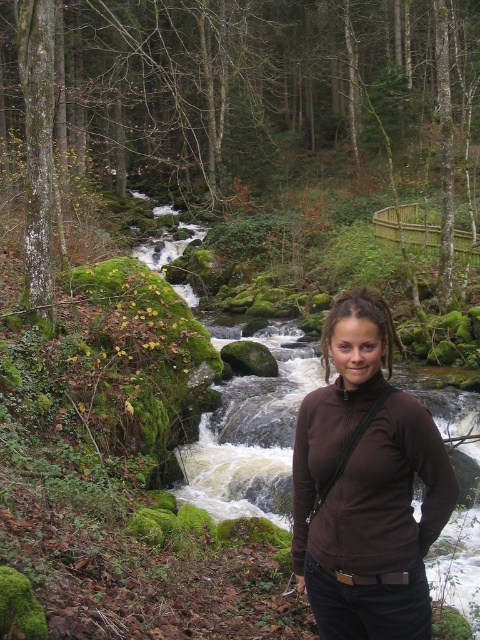
Can you confirm if brown matte jacket at center is positioned to the right of white frothy water at center?

Yes, brown matte jacket at center is to the right of white frothy water at center.

Identify the location of brown matte jacket at center. Image resolution: width=480 pixels, height=640 pixels. (365, 484).

Is point (320, 461) positioned behind point (416, 390)?

That is False.

Where is `brown matte jacket at center`? brown matte jacket at center is located at coordinates (365, 484).